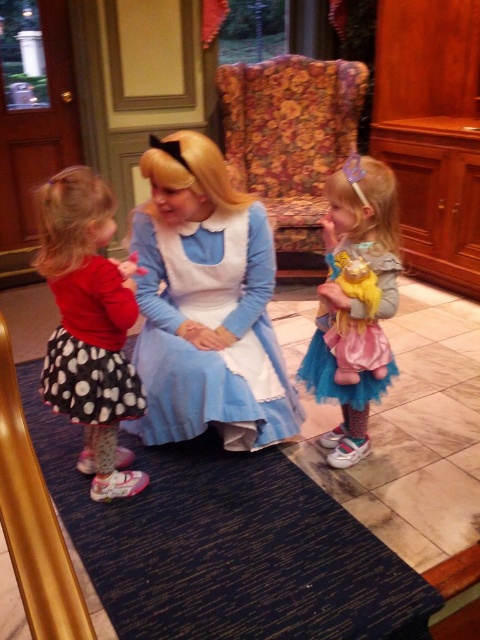
Is point (382, 193) farther from camera compared to point (119, 364)?

No, it is in front of (119, 364).

Is pastel pink tulle skirt at center positioned behind black dotted fabric dress at left?

That is True.

Measure the distance between point (x=334, y=358) and camera.

Point (x=334, y=358) and camera are 6.26 feet apart from each other.

Locate an element on the screen. pastel pink tulle skirt at center is located at coordinates (355, 304).

Which is above, blue satin dress at center or pastel pink tulle skirt at center?

blue satin dress at center is higher up.

Is point (188, 371) more distant than point (377, 298)?

Yes.

Measure the distance between point (144, 296) and camera.

They are 1.98 meters apart.

Image resolution: width=480 pixels, height=640 pixels. I want to click on blue satin dress at center, so click(206, 305).

Between blue satin dress at center and polka dot skirt at left, which one is positioned lower?

Positioned lower is polka dot skirt at left.

Which of these two, blue satin dress at center or polka dot skirt at left, stands taller?

Standing taller between the two is blue satin dress at center.

Does point (167, 208) come in front of point (118, 273)?

No, it is not.

Locate an element on the screen. The height and width of the screenshot is (640, 480). blue satin dress at center is located at coordinates (206, 305).